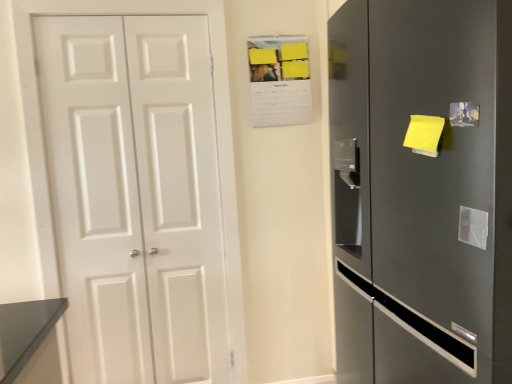
Question: Considering the relative positions of satin silver refrigerator at right and white matte door at left in the image provided, is satin silver refrigerator at right to the left of white matte door at left from the viewer's perspective?

Choices:
 (A) no
 (B) yes

Answer: (A)

Question: Is satin silver refrigerator at right shorter than white matte door at left?

Choices:
 (A) yes
 (B) no

Answer: (A)

Question: Can you confirm if satin silver refrigerator at right is bigger than white matte door at left?

Choices:
 (A) no
 (B) yes

Answer: (B)

Question: Is satin silver refrigerator at right positioned with its back to white matte door at left?

Choices:
 (A) yes
 (B) no

Answer: (B)

Question: Does satin silver refrigerator at right have a smaller size compared to white matte door at left?

Choices:
 (A) no
 (B) yes

Answer: (A)

Question: Can you confirm if satin silver refrigerator at right is taller than white matte door at left?

Choices:
 (A) no
 (B) yes

Answer: (A)

Question: From the image's perspective, is white matte door at left located above satin silver refrigerator at right?

Choices:
 (A) no
 (B) yes

Answer: (B)

Question: Considering the relative sizes of white matte door at left and satin silver refrigerator at right in the image provided, is white matte door at left taller than satin silver refrigerator at right?

Choices:
 (A) no
 (B) yes

Answer: (B)

Question: Considering the relative positions of white matte door at left and satin silver refrigerator at right in the image provided, is white matte door at left to the left of satin silver refrigerator at right from the viewer's perspective?

Choices:
 (A) yes
 (B) no

Answer: (A)

Question: From a real-world perspective, does white matte door at left sit lower than satin silver refrigerator at right?

Choices:
 (A) no
 (B) yes

Answer: (A)

Question: Is there a large distance between white matte door at left and satin silver refrigerator at right?

Choices:
 (A) yes
 (B) no

Answer: (A)

Question: Is white matte door at left wider than satin silver refrigerator at right?

Choices:
 (A) yes
 (B) no

Answer: (B)

Question: Considering the positions of satin silver refrigerator at right and white matte door at left in the image, is satin silver refrigerator at right wider or thinner than white matte door at left?

Choices:
 (A) thin
 (B) wide

Answer: (B)